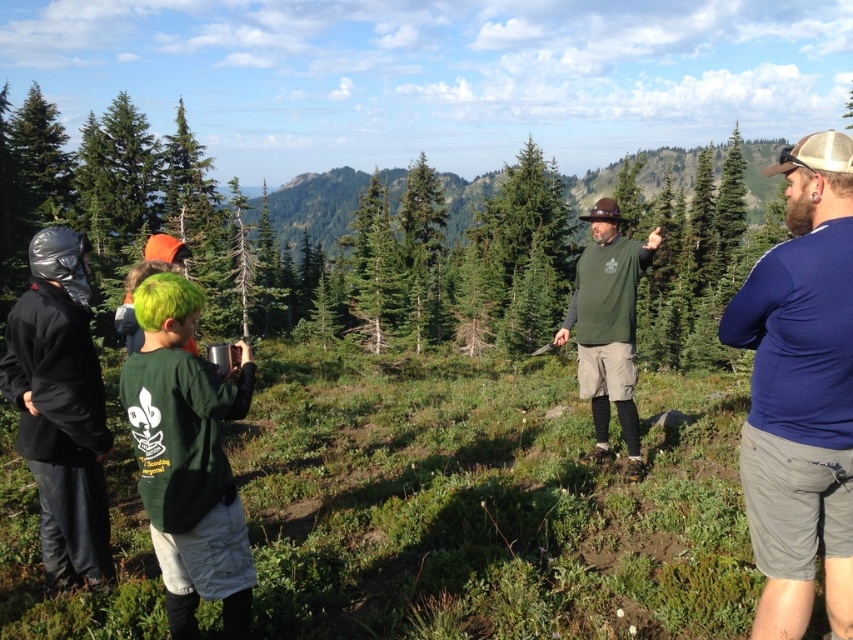
Who is positioned more to the left, blue long-sleeve shirt at right or black matte jacket at left?

From the viewer's perspective, black matte jacket at left appears more on the left side.

In the scene shown: Between blue long-sleeve shirt at right and black matte jacket at left, which one has less height?

With less height is black matte jacket at left.

The width and height of the screenshot is (853, 640). What are the coordinates of `blue long-sleeve shirt at right` in the screenshot? It's located at (801, 392).

The width and height of the screenshot is (853, 640). What are the coordinates of `black matte jacket at left` in the screenshot? It's located at (61, 408).

Which is above, black matte jacket at left or green matte shirt at center?

green matte shirt at center

Is point (77, 396) positioned before point (587, 392)?

Yes, it is in front of point (587, 392).

Locate an element on the screen. Image resolution: width=853 pixels, height=640 pixels. black matte jacket at left is located at coordinates (61, 408).

Is green matte shirt at lower left shorter than black matte jacket at left?

Yes.

Who is more distant from viewer, (x=173, y=461) or (x=33, y=380)?

Point (x=33, y=380)

Is point (238, 611) positioned in front of point (56, 227)?

Yes, it is in front of point (56, 227).

The width and height of the screenshot is (853, 640). Identify the location of green matte shirt at lower left. [187, 458].